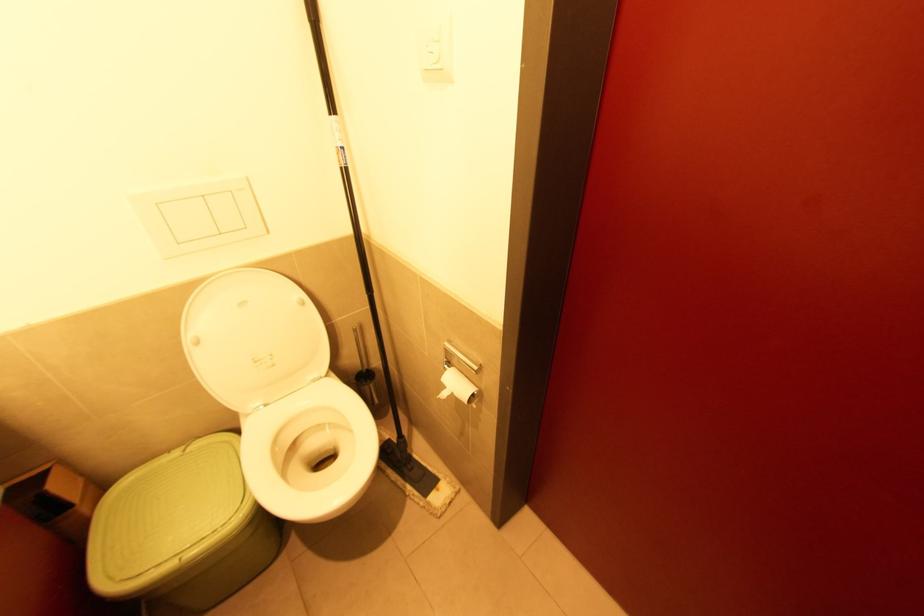
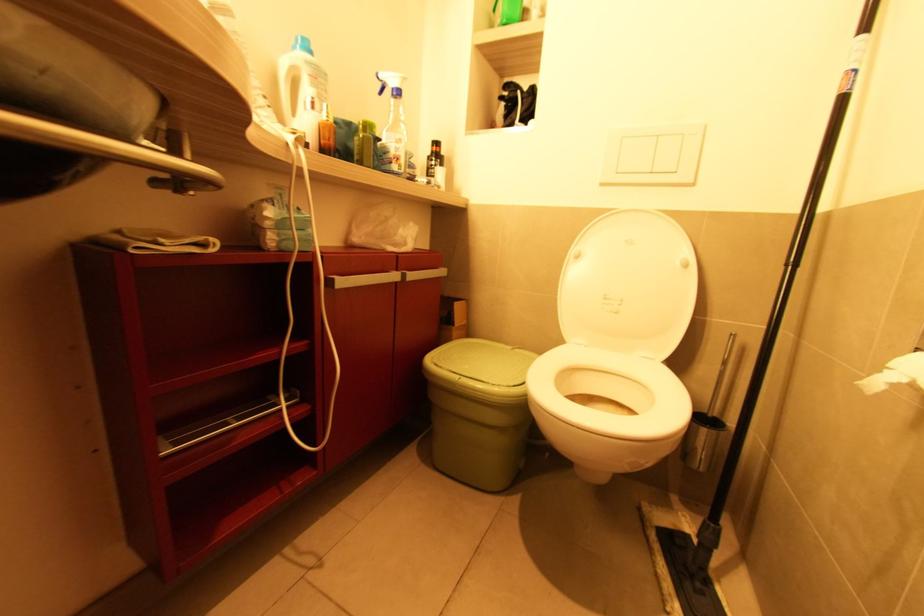
Question: The first image is from the beginning of the video and the second image is from the end. How did the camera likely rotate when shooting the video?

Choices:
 (A) Left
 (B) Right
 (C) Up
 (D) Down

Answer: (A)